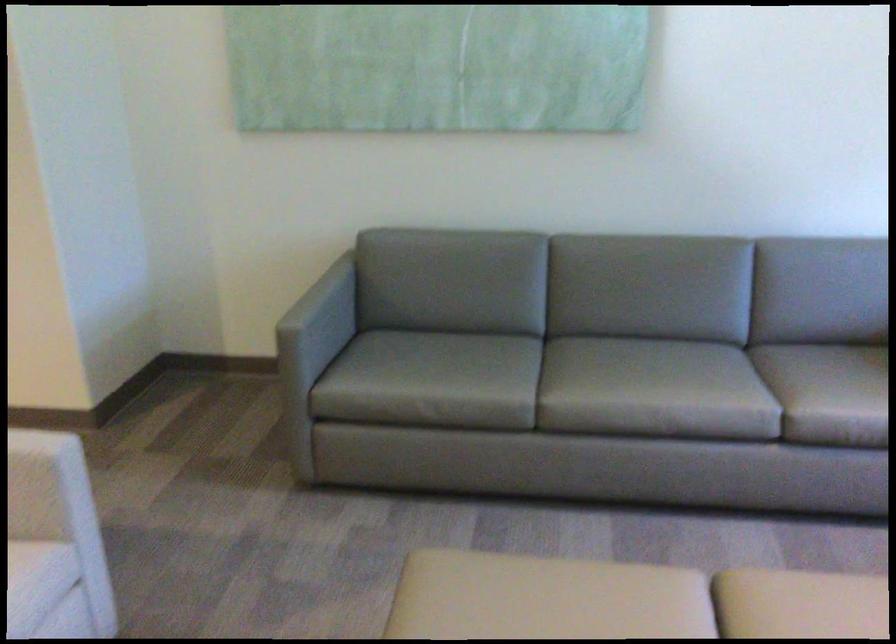
Where would you sit the sofa sitting surface? Please return your answer as a coordinate pair (x, y).

(613, 386)